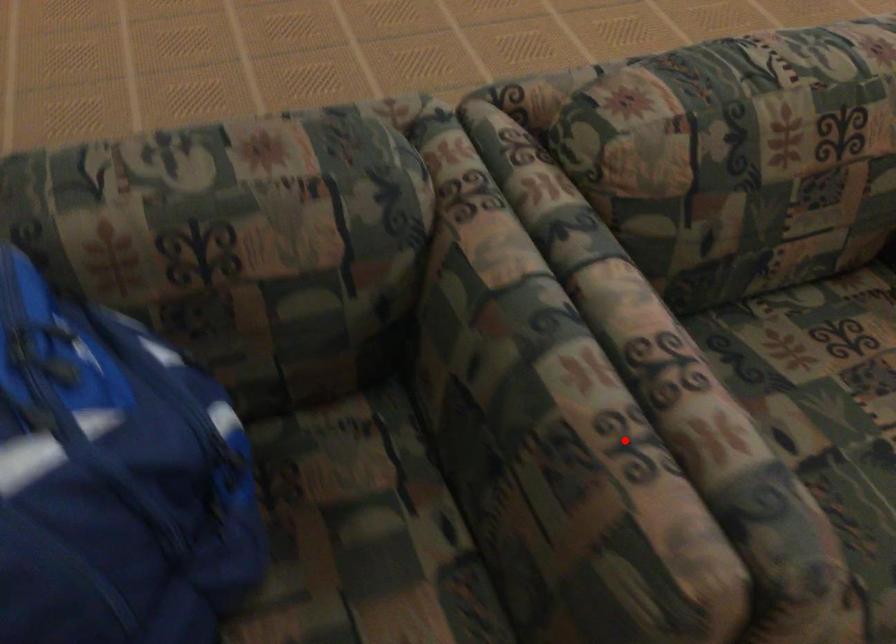
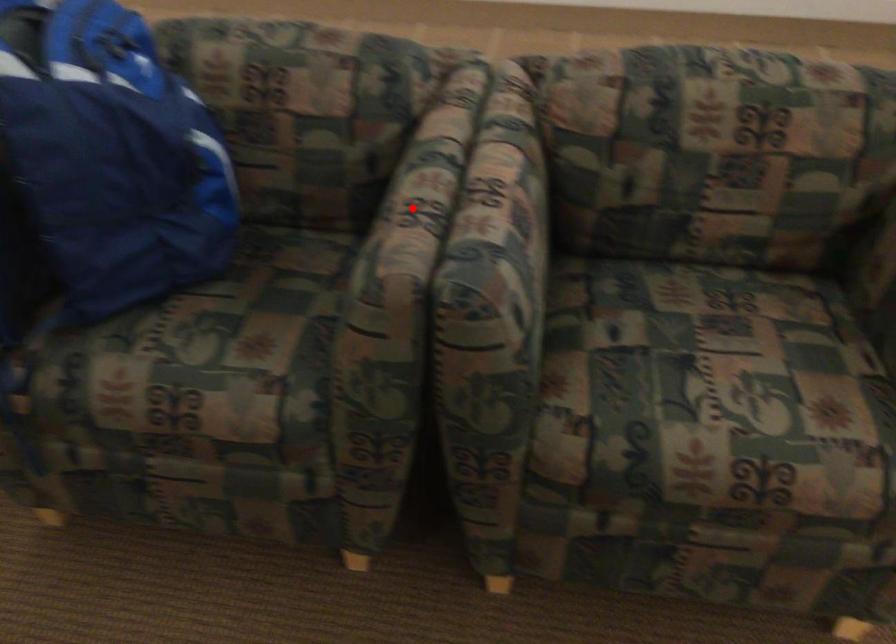
I am providing you with two images of the same scene from different viewpoints. A red point is marked on the first image and another point is marked on the second image. Is the red point in image1 aligned with the point shown in image2?

Yes